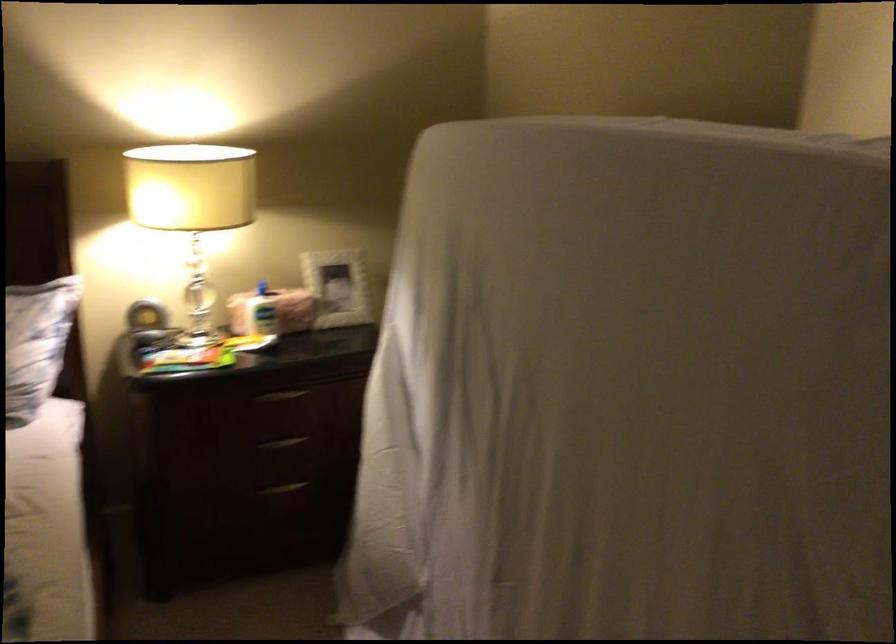
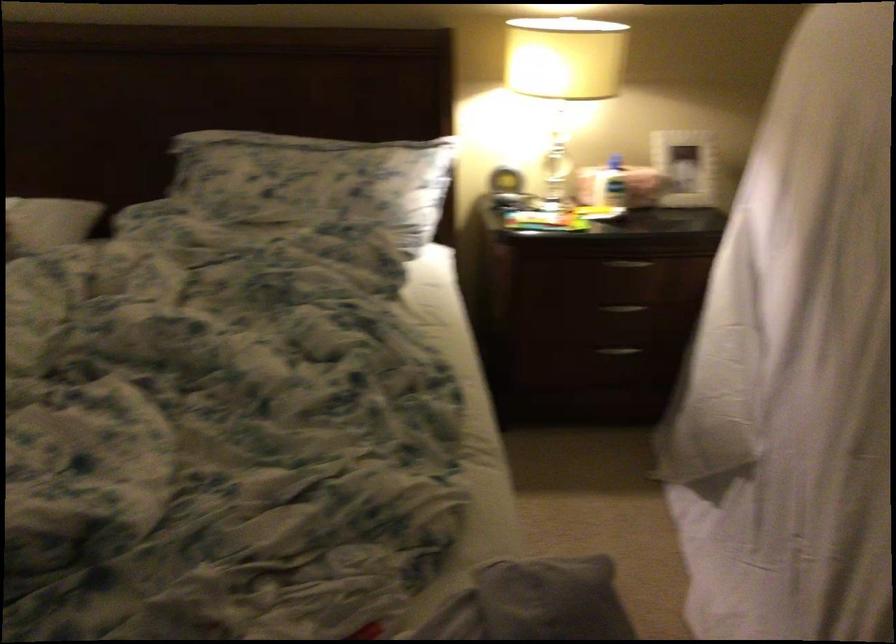
Find the pixel in the second image that matches point 283,447 in the first image.

(624, 308)